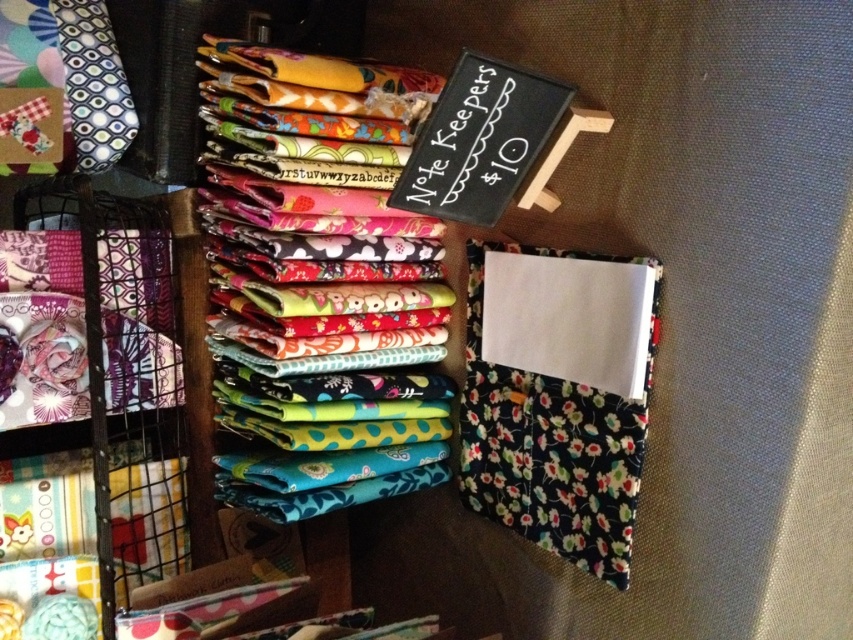
Between vibrant printed fabric at center and patterned fabric tie at upper left, which one appears on the right side from the viewer's perspective?

vibrant printed fabric at center

Consider the image. Who is more forward, (384, 330) or (93, 166)?

Positioned in front is point (93, 166).

Identify the location of vibrant printed fabric at center. (321, 284).

Between point (412, 189) and point (106, 64), which one is positioned in front?

Positioned in front is point (412, 189).

The image size is (853, 640). Describe the element at coordinates (479, 140) in the screenshot. I see `black chalkboard at upper center` at that location.

Does point (445, 106) lie behind point (56, 16)?

No, it is in front of (56, 16).

The image size is (853, 640). What are the coordinates of `black chalkboard at upper center` in the screenshot? It's located at (479, 140).

Is point (276, 173) positioned behind point (427, 156)?

Yes, it is.

Measure the distance between vibrant printed fabric at center and black chalkboard at upper center.

vibrant printed fabric at center is 8.52 inches from black chalkboard at upper center.

Who is more distant from viewer, (352, 388) or (438, 161)?

Point (352, 388)

Locate an element on the screen. vibrant printed fabric at center is located at coordinates (321, 284).